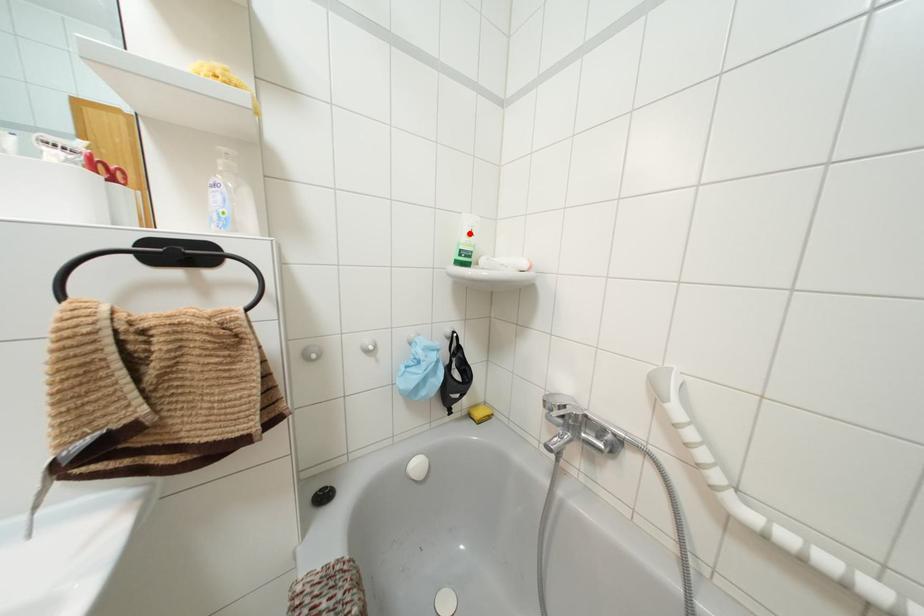
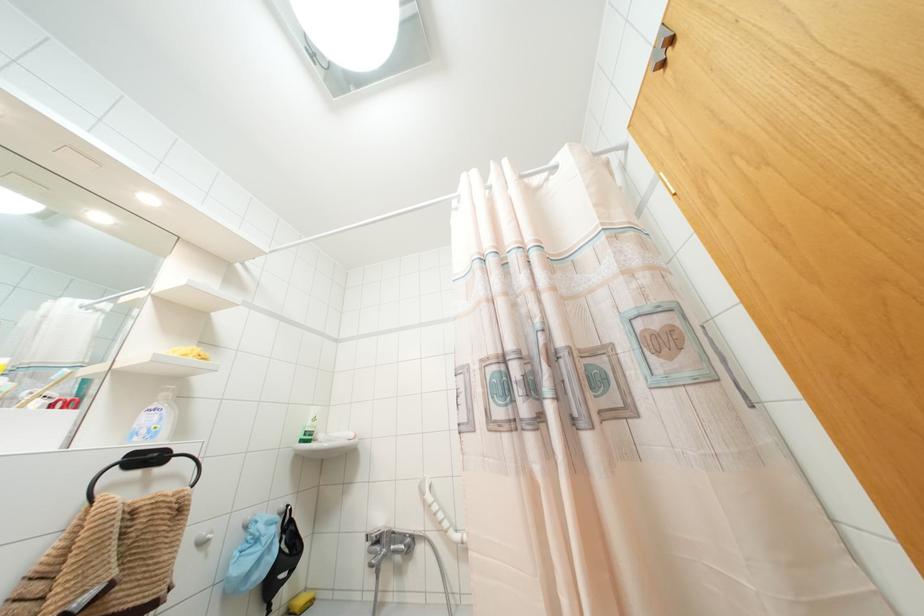
Locate, in the second image, the point that corresponds to the highlighted location in the first image.

(312, 419)